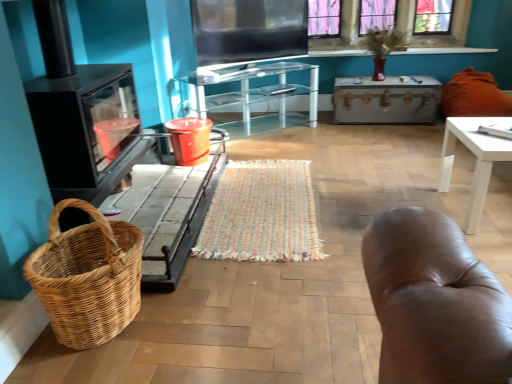
What is the approximate width of orange fabric pillow at right?

The width of orange fabric pillow at right is 29.29 inches.

The height and width of the screenshot is (384, 512). What do you see at coordinates (476, 160) in the screenshot?
I see `white glossy table at right` at bounding box center [476, 160].

Describe the element at coordinates (88, 277) in the screenshot. This screenshot has height=384, width=512. I see `woven brown picnic basket at lower left` at that location.

The width and height of the screenshot is (512, 384). Find the location of `pink glass window at upper center`. pink glass window at upper center is located at coordinates (434, 35).

The width and height of the screenshot is (512, 384). Identify the location of black glass fireplace at left. (19, 145).

This screenshot has height=384, width=512. Describe the element at coordinates (19, 145) in the screenshot. I see `black glass fireplace at left` at that location.

This screenshot has width=512, height=384. Find the location of `orange fabric pillow at right`. orange fabric pillow at right is located at coordinates (474, 96).

Between black glass fireplace at left and woven brown picnic basket at lower left, which one has larger width?

Wider between the two is black glass fireplace at left.

Would you consider black glass fireplace at left to be distant from woven brown picnic basket at lower left?

Yes, black glass fireplace at left and woven brown picnic basket at lower left are located far from each other.

Visually, is black glass fireplace at left positioned to the left or to the right of woven brown picnic basket at lower left?

Clearly, black glass fireplace at left is on the left of woven brown picnic basket at lower left in the image.

Between black glass fireplace at left and woven brown picnic basket at lower left, which one has more height?

With more height is black glass fireplace at left.

Can you see white glossy table at right touching woven brown picnic basket at lower left?

No, white glossy table at right is not next to woven brown picnic basket at lower left.

From the image's perspective, is white glossy table at right above woven brown picnic basket at lower left?

Yes, from the image's perspective, white glossy table at right is over woven brown picnic basket at lower left.

Is woven brown picnic basket at lower left completely or partially inside white glossy table at right?

No, woven brown picnic basket at lower left is not a part of white glossy table at right.

Considering the sizes of white glossy table at right and woven brown picnic basket at lower left in the image, is white glossy table at right wider or thinner than woven brown picnic basket at lower left?

Considering their sizes, white glossy table at right looks broader than woven brown picnic basket at lower left.

Considering the relative positions of beige leather trunk at upper center and pink glass window at upper center in the image provided, is beige leather trunk at upper center to the right of pink glass window at upper center from the viewer's perspective?

In fact, beige leather trunk at upper center is to the left of pink glass window at upper center.

In order to click on window behind the beige leather trunk at upper center in this screenshot , I will do tap(434, 35).

Which is closer to the camera, (x=399, y=108) or (x=452, y=36)?

Point (x=399, y=108).

How many degrees apart are the facing directions of beige leather trunk at upper center and pink glass window at upper center?

There is a 1.95-degree angle between the facing directions of beige leather trunk at upper center and pink glass window at upper center.

Does point (465, 104) come behind point (202, 35)?

Yes, it is behind point (202, 35).

How far apart are orange fabric pillow at right and flat matte screen at upper center?

They are 5.68 feet apart.

Identify the location of pillow behind the flat matte screen at upper center. (474, 96).

From a real-world perspective, is orange fabric pillow at right on flat matte screen at upper center?

No, from a real-world perspective, orange fabric pillow at right is not on top of flat matte screen at upper center.

Is orange fabric pillow at right oriented towards pink glass window at upper center?

No, orange fabric pillow at right is not oriented towards pink glass window at upper center.

Who is smaller, orange fabric pillow at right or pink glass window at upper center?

With smaller size is pink glass window at upper center.

Would you consider orange fabric pillow at right to be distant from pink glass window at upper center?

orange fabric pillow at right is actually quite close to pink glass window at upper center.

From the image's perspective, does orange fabric pillow at right appear higher than pink glass window at upper center?

No, from the image's perspective, orange fabric pillow at right is not on top of pink glass window at upper center.

Does point (256, 7) come farther from viewer compared to point (471, 149)?

That is True.

Is flat matte screen at upper center located outside white glossy table at right?

Yes, flat matte screen at upper center is located beyond the bounds of white glossy table at right.

Measure the distance from flat matte screen at upper center to white glossy table at right.

1.84 meters.

Considering the positions of objects flat matte screen at upper center and white glossy table at right in the image provided, who is behind, flat matte screen at upper center or white glossy table at right?

Positioned behind is flat matte screen at upper center.

From a real-world perspective, is transparent glass cabinet at center positioned above or below woven brown picnic basket at lower left?

transparent glass cabinet at center is above woven brown picnic basket at lower left.

Considering the positions of objects transparent glass cabinet at center and woven brown picnic basket at lower left in the image provided, who is more to the left, transparent glass cabinet at center or woven brown picnic basket at lower left?

woven brown picnic basket at lower left.

Where is `picnic basket located on the left of transparent glass cabinet at center`? This screenshot has width=512, height=384. picnic basket located on the left of transparent glass cabinet at center is located at coordinates (88, 277).

How different are the orientations of transparent glass cabinet at center and woven brown picnic basket at lower left in degrees?

The angular difference between transparent glass cabinet at center and woven brown picnic basket at lower left is 53 degrees.

In order to click on fireplace on the left of woven brown picnic basket at lower left in this screenshot , I will do `click(19, 145)`.

You are a GUI agent. You are given a task and a screenshot of the screen. Output one action in this format:
    pyautogui.click(x=<x>, y=<y>)
    Task: Click on the desk behind the woven brown picnic basket at lower left
    This screenshot has height=384, width=512.
    Given the screenshot: What is the action you would take?
    pyautogui.click(x=476, y=160)

Estimate the real-world distances between objects in this image. Which object is further from black glass fireplace at left, woven brown picnic basket at lower left or white glossy table at right?

white glossy table at right lies further to black glass fireplace at left than the other object.

Estimate the real-world distances between objects in this image. Which object is further from orange fabric pillow at right, beige leather trunk at upper center or pink glass window at upper center?

pink glass window at upper center is further to orange fabric pillow at right.

From the image, which object appears to be farther from flat matte screen at upper center, transparent glass cabinet at center or woven multicolored mat at center?

woven multicolored mat at center is further to flat matte screen at upper center.

From the image, which object appears to be nearer to woven multicolored mat at center, orange fabric pillow at right or white glossy table at right?

Based on the image, white glossy table at right appears to be nearer to woven multicolored mat at center.

Estimate the real-world distances between objects in this image. Which object is closer to beige leather trunk at upper center, flat matte screen at upper center or woven multicolored mat at center?

Based on the image, flat matte screen at upper center appears to be nearer to beige leather trunk at upper center.

When comparing their distances from beige leather trunk at upper center, does pink glass window at upper center or flat matte screen at upper center seem closer?

The object closer to beige leather trunk at upper center is pink glass window at upper center.

Looking at the image, which one is located closer to flat matte screen at upper center, woven multicolored mat at center or pink glass window at upper center?

woven multicolored mat at center is positioned closer to the anchor flat matte screen at upper center.

Looking at the image, which one is located closer to transparent glass cabinet at center, pink glass window at upper center or white glossy table at right?

Among the two, pink glass window at upper center is located nearer to transparent glass cabinet at center.

Where is `mat between transparent glass cabinet at center and orange fabric pillow at right from left to right`? The height and width of the screenshot is (384, 512). mat between transparent glass cabinet at center and orange fabric pillow at right from left to right is located at coordinates (262, 214).

Image resolution: width=512 pixels, height=384 pixels. What are the coordinates of `cabinetry between woven multicolored mat at center and pink glass window at upper center along the z-axis` in the screenshot? It's located at (256, 96).

Image resolution: width=512 pixels, height=384 pixels. What are the coordinates of `fireplace between woven brown picnic basket at lower left and transparent glass cabinet at center in the front-back direction` in the screenshot? It's located at (19, 145).

What are the coordinates of `mat between black glass fireplace at left and pink glass window at upper center from front to back` in the screenshot? It's located at (262, 214).